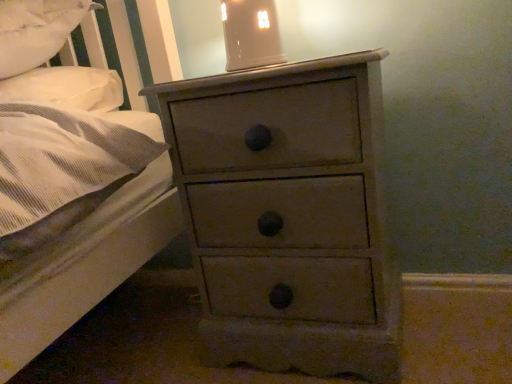
In order to click on free region under white soft pillow at upper left (from a real-world perspective) in this screenshot , I will do `click(97, 335)`.